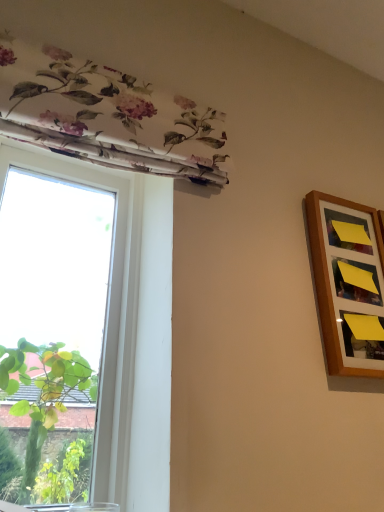
Question: From their relative heights in the image, would you say wooden picture frame at right is taller or shorter than white fabric window at upper left?

Choices:
 (A) short
 (B) tall

Answer: (A)

Question: Considering their positions, is wooden picture frame at right located in front of or behind white fabric window at upper left?

Choices:
 (A) front
 (B) behind

Answer: (B)

Question: From the image's perspective, is wooden picture frame at right located above or below white fabric window at upper left?

Choices:
 (A) above
 (B) below

Answer: (A)

Question: Does point coord(117,444) appear closer or farther from the camera than point coord(362,231)?

Choices:
 (A) closer
 (B) farther

Answer: (A)

Question: From the image's perspective, is white fabric window at upper left positioned above or below wooden picture frame at right?

Choices:
 (A) above
 (B) below

Answer: (B)

Question: Is white fabric window at upper left taller or shorter than wooden picture frame at right?

Choices:
 (A) short
 (B) tall

Answer: (B)

Question: Is white fabric window at upper left in front of or behind wooden picture frame at right in the image?

Choices:
 (A) behind
 (B) front

Answer: (B)